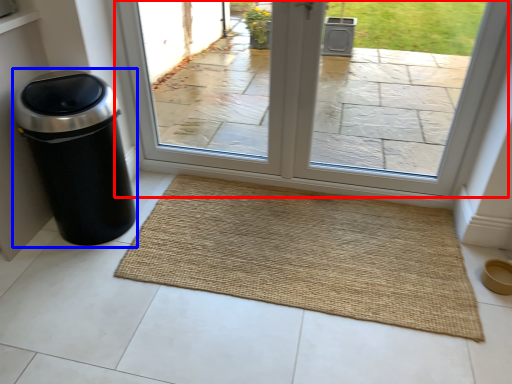
Question: Which object is closer to the camera taking this photo, window (highlighted by a red box) or waste container (highlighted by a blue box)?

Choices:
 (A) window
 (B) waste container

Answer: (B)